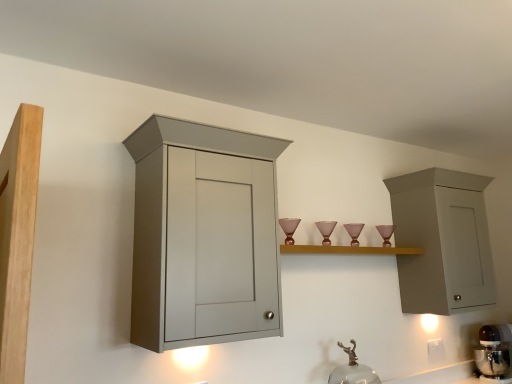
Question: Is transparent glass faucet at lower center turned away from matte wood cupboard at left?

Choices:
 (A) no
 (B) yes

Answer: (A)

Question: Considering the relative sizes of transparent glass faucet at lower center and matte wood cupboard at left in the image provided, is transparent glass faucet at lower center smaller than matte wood cupboard at left?

Choices:
 (A) no
 (B) yes

Answer: (B)

Question: Is transparent glass faucet at lower center touching matte wood cupboard at left?

Choices:
 (A) no
 (B) yes

Answer: (A)

Question: Is transparent glass faucet at lower center aimed at matte wood cupboard at left?

Choices:
 (A) no
 (B) yes

Answer: (A)

Question: Is transparent glass faucet at lower center bigger than matte wood cupboard at left?

Choices:
 (A) yes
 (B) no

Answer: (B)

Question: Visually, is matte wood cupboard at left positioned to the left or to the right of light wood shelf at center?

Choices:
 (A) left
 (B) right

Answer: (A)

Question: From the image's perspective, relative to light wood shelf at center, is matte wood cupboard at left above or below?

Choices:
 (A) below
 (B) above

Answer: (B)

Question: Considering the positions of point coord(33,173) and point coord(371,251), is point coord(33,173) closer or farther from the camera than point coord(371,251)?

Choices:
 (A) closer
 (B) farther

Answer: (A)

Question: Choose the correct answer: Is matte wood cupboard at left inside light wood shelf at center or outside it?

Choices:
 (A) inside
 (B) outside

Answer: (B)

Question: Is white plastic electric outlet at lower right wider or thinner than metallic silver mixer at lower right?

Choices:
 (A) thin
 (B) wide

Answer: (A)

Question: From their relative heights in the image, would you say white plastic electric outlet at lower right is taller or shorter than metallic silver mixer at lower right?

Choices:
 (A) tall
 (B) short

Answer: (B)

Question: Is white plastic electric outlet at lower right spatially inside metallic silver mixer at lower right, or outside of it?

Choices:
 (A) outside
 (B) inside

Answer: (A)

Question: From the image's perspective, relative to metallic silver mixer at lower right, is white plastic electric outlet at lower right above or below?

Choices:
 (A) below
 (B) above

Answer: (B)

Question: From the image's perspective, is white plastic electric outlet at lower right positioned above or below matte wood cupboard at left?

Choices:
 (A) above
 (B) below

Answer: (B)

Question: Choose the correct answer: Is white plastic electric outlet at lower right inside matte wood cupboard at left or outside it?

Choices:
 (A) outside
 (B) inside

Answer: (A)